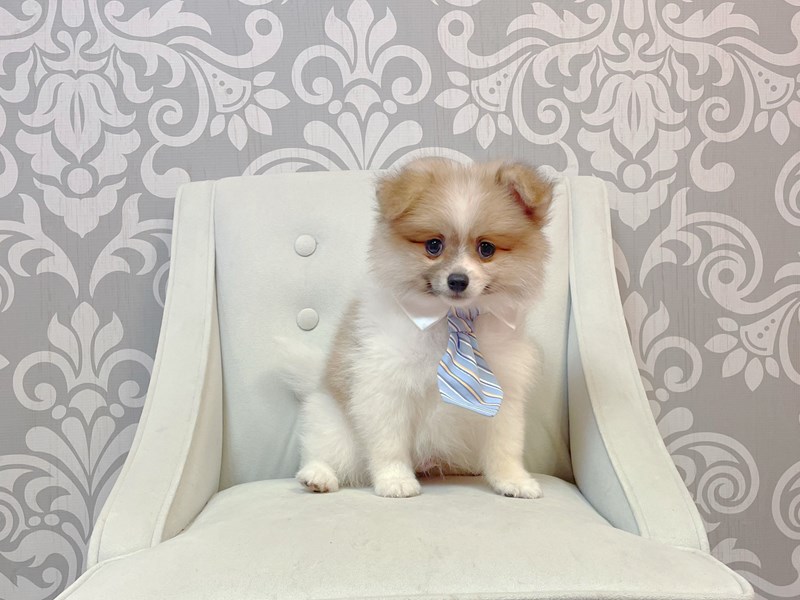
The height and width of the screenshot is (600, 800). Identify the location of chair back. (246, 355).